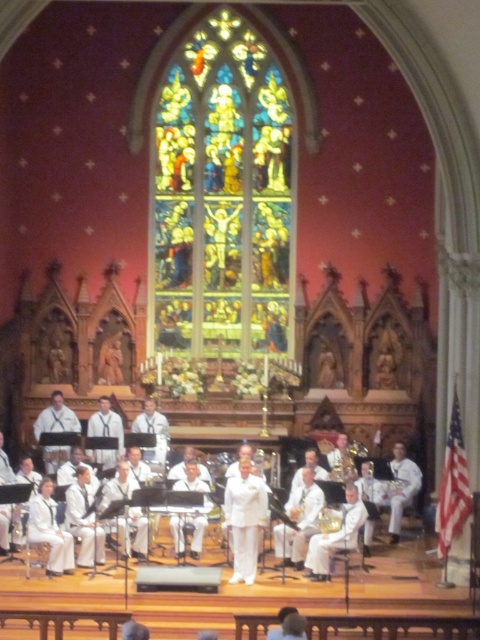
Which is more to the right, stained glass window at center or white uniform at center?

Positioned to the right is stained glass window at center.

Between point (220, 259) and point (251, 416), which one is positioned behind?

Point (220, 259)

Describe the element at coordinates (223, 196) in the screenshot. Image resolution: width=480 pixels, height=640 pixels. I see `stained glass window at center` at that location.

Where is `stained glass window at center`? stained glass window at center is located at coordinates (223, 196).

Can you confirm if white uniform at center is bigger than gold metallic saxophone at center?

Yes, white uniform at center is bigger than gold metallic saxophone at center.

Can you confirm if white uniform at center is taller than gold metallic saxophone at center?

Correct, white uniform at center is much taller as gold metallic saxophone at center.

Who is more distant from viewer, (108,472) or (334,516)?

The point (108,472) is behind.

At what (x,y) coordinates should I click in order to perform the action: click on white uniform at center. Please return your answer as a coordinate pair (x, y). Looking at the image, I should click on coord(296,428).

Who is more forward, (x=192, y=102) or (x=334, y=515)?

Point (x=334, y=515) is more forward.

Between point (255, 177) and point (340, 509), which one is positioned in front?

Point (340, 509) is in front.

Where is `stained glass window at center`? stained glass window at center is located at coordinates (223, 196).